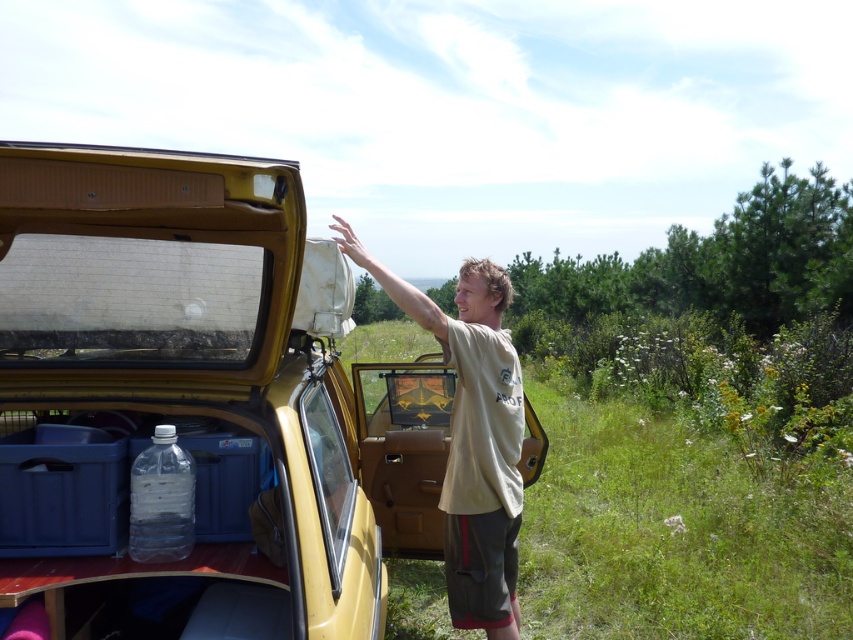
Question: Which point is closer to the camera taking this photo?

Choices:
 (A) (457, 292)
 (B) (73, 544)
 (C) (144, 552)

Answer: (C)

Question: Is yellow matte car at center bigger than beige cotton t-shirt at center?

Choices:
 (A) no
 (B) yes

Answer: (B)

Question: Estimate the real-world distances between objects in this image. Which object is closer to the clear plastic bottle at lower left?

Choices:
 (A) yellow matte car at center
 (B) beige cotton t-shirt at center

Answer: (A)

Question: Can you confirm if yellow matte car at center is thinner than beige cotton t-shirt at center?

Choices:
 (A) no
 (B) yes

Answer: (A)

Question: Is yellow matte car at center further to camera compared to beige cotton t-shirt at center?

Choices:
 (A) no
 (B) yes

Answer: (A)

Question: Among these objects, which one is nearest to the camera?

Choices:
 (A) yellow matte car at center
 (B) beige cotton t-shirt at center
 (C) clear plastic bottle at lower left

Answer: (A)